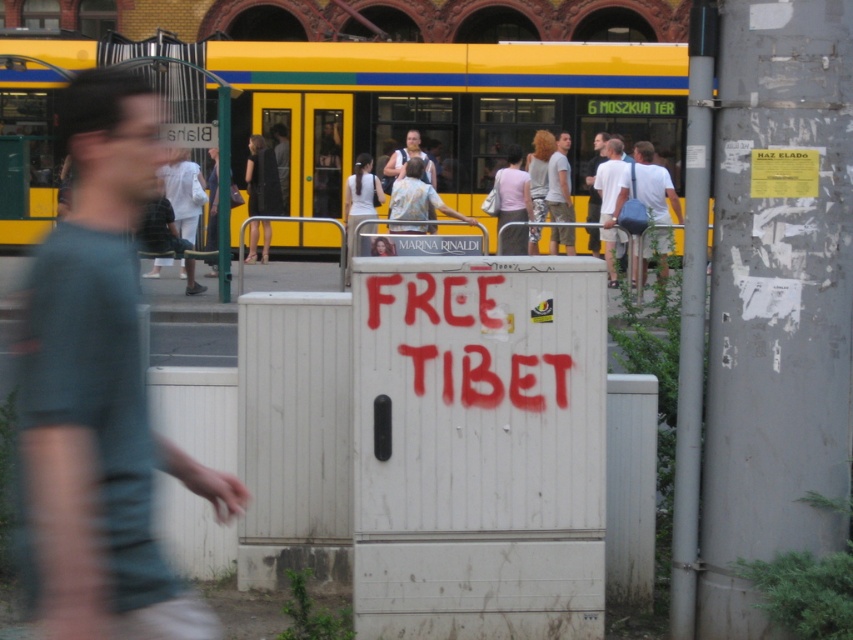
Question: Is yellow painted metal train at upper center below light pink fabric shirt at center?

Choices:
 (A) yes
 (B) no

Answer: (B)

Question: Which object is positioned farthest from the white cotton shirt at center?

Choices:
 (A) yellow painted metal train at upper center
 (B) matte gray tank top at center
 (C) green t-shirt at left
 (D) light pink fabric shirt at center

Answer: (C)

Question: Which point is farther to the camera?

Choices:
 (A) (102, 76)
 (B) (605, 216)
 (C) (526, 192)

Answer: (C)

Question: Is green t-shirt at left positioned at the back of white cotton shirt at center?

Choices:
 (A) no
 (B) yes

Answer: (A)

Question: Observing the image, what is the correct spatial positioning of white cotton shirt at center in reference to white cotton shirt at upper center?

Choices:
 (A) below
 (B) above

Answer: (B)

Question: Which point is closer to the camera?

Choices:
 (A) matte gray tank top at center
 (B) light pink fabric shirt at center

Answer: (B)